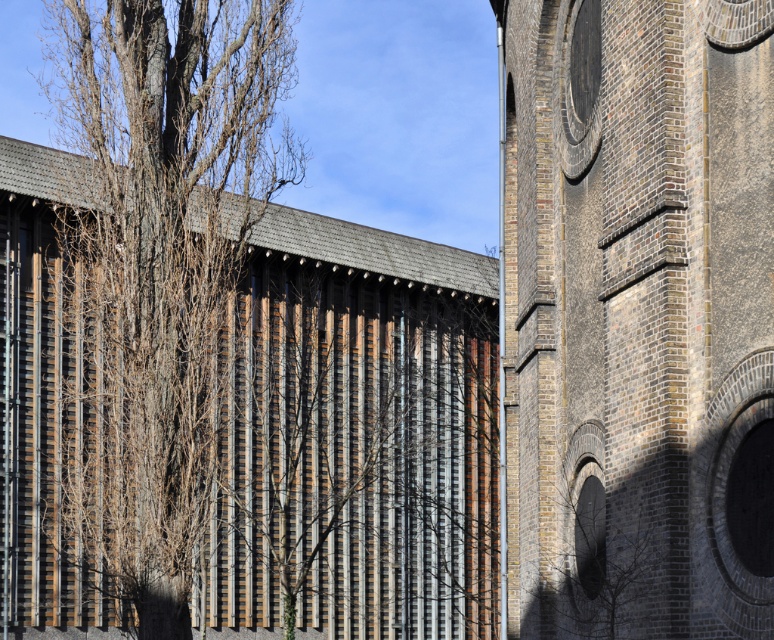
Can you confirm if bare branches at left is positioned above brown wooden slats at center?

Correct, bare branches at left is located above brown wooden slats at center.

Can you confirm if bare branches at left is taller than brown wooden slats at center?

Indeed, bare branches at left has a greater height compared to brown wooden slats at center.

Is point (105, 304) behind point (467, 388)?

No, it is not.

Locate an element on the screen. bare branches at left is located at coordinates (163, 260).

Can you confirm if brick tower at right is taller than brown wooden slats at center?

No.

Find the location of `brick tower at right`. brick tower at right is located at coordinates (639, 316).

The height and width of the screenshot is (640, 774). Describe the element at coordinates (639, 316) in the screenshot. I see `brick tower at right` at that location.

Is point (545, 570) more distant than point (156, 253)?

No, it is not.

I want to click on brick tower at right, so [x=639, y=316].